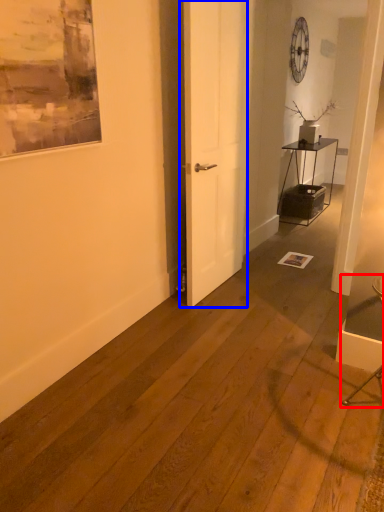
Question: Which point is closer to the camera, armchair (highlighted by a red box) or door (highlighted by a blue box)?

Choices:
 (A) armchair
 (B) door

Answer: (A)